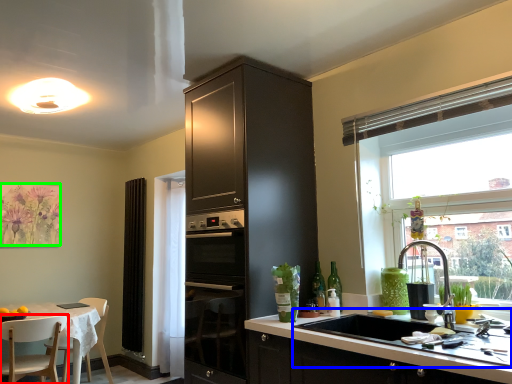
Question: Based on their relative distances, which object is farther from chair (highlighted by a red box)? Choose from sink (highlighted by a blue box) and flower (highlighted by a green box).

Choices:
 (A) sink
 (B) flower

Answer: (A)